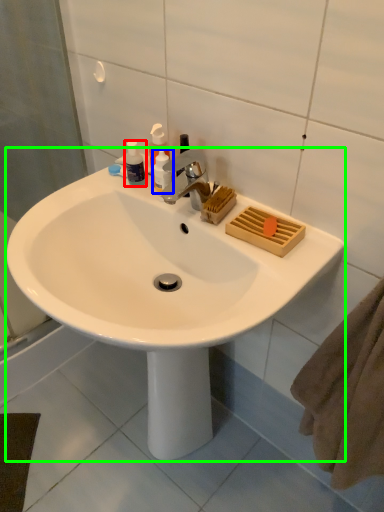
Question: Which object is positioned closest to toiletry (highlighted by a red box)? Select from toiletry (highlighted by a blue box) and sink (highlighted by a green box).

Choices:
 (A) toiletry
 (B) sink

Answer: (A)